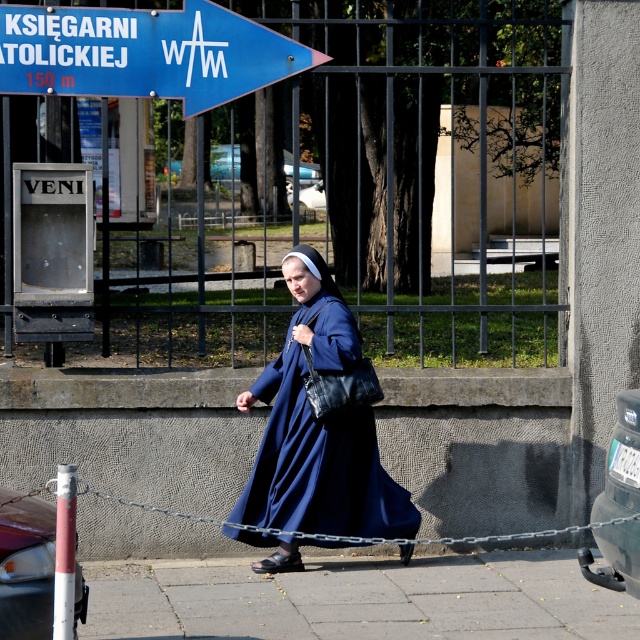
Based on the photo, you are a delivery robot with a height of 3 feet. You need to move from the gray concrete pavement at lower center to the metallic silver chain at lower center. Can you pass through the space between them?

The distance between the gray concrete pavement at lower center and the metallic silver chain at lower center is 23.04 inches. Since the robot is 3 feet tall, which is 36 inches, it cannot pass through the space between them as the height is insufficient.

You are a pedestrian standing at the point marked by the coordinates point (356, 598), which is on the gray concrete pavement at lower center. You want to walk to the sidewalk where the nun is walking. Which direction should you go?

The point (356, 598) is on the gray concrete pavement at lower center, so you should walk towards the right side of the frame where the nun is walking.